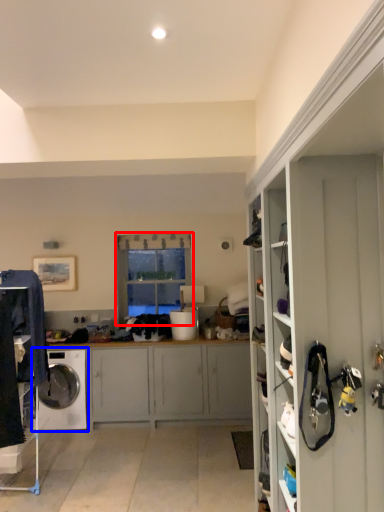
Question: Which point is closer to the camera, window (highlighted by a red box) or washing machine (highlighted by a blue box)?

Choices:
 (A) window
 (B) washing machine

Answer: (B)